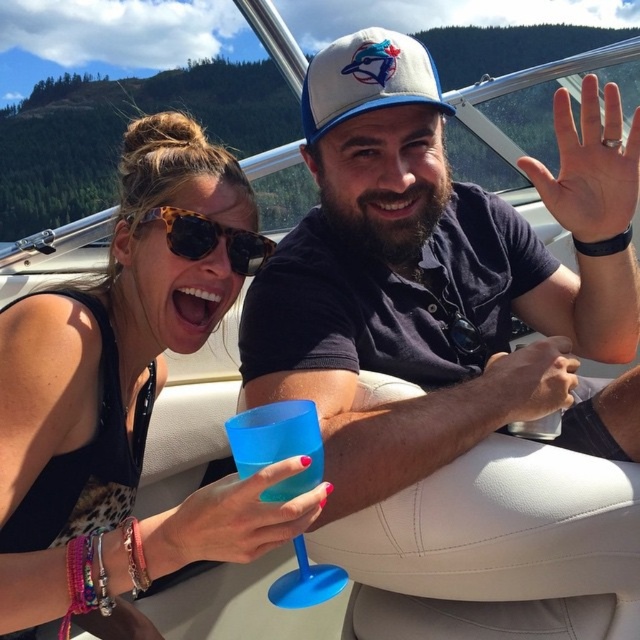
Question: Is gold metallic ring at upper right above white fabric baseball cap at center?

Choices:
 (A) no
 (B) yes

Answer: (A)

Question: Which object is the farthest from the white fabric baseball cap at center?

Choices:
 (A) matte black watch at center
 (B) matte plastic cup at center

Answer: (A)

Question: Among these points, which one is farthest from the camera?

Choices:
 (A) [1, 372]
 (B) [257, 483]

Answer: (A)

Question: Does matte black tank top at upper left have a larger size compared to gold metallic ring at upper right?

Choices:
 (A) no
 (B) yes

Answer: (B)

Question: Which of these objects is positioned farthest from the matte plastic cup at center?

Choices:
 (A) blue plastic wine glass at lower center
 (B) gold metallic ring at upper right
 (C) matte black watch at center
 (D) white fabric baseball cap at center

Answer: (A)

Question: Is the position of gold metallic ring at upper right more distant than that of blue plastic wine glass at lower center?

Choices:
 (A) yes
 (B) no

Answer: (A)